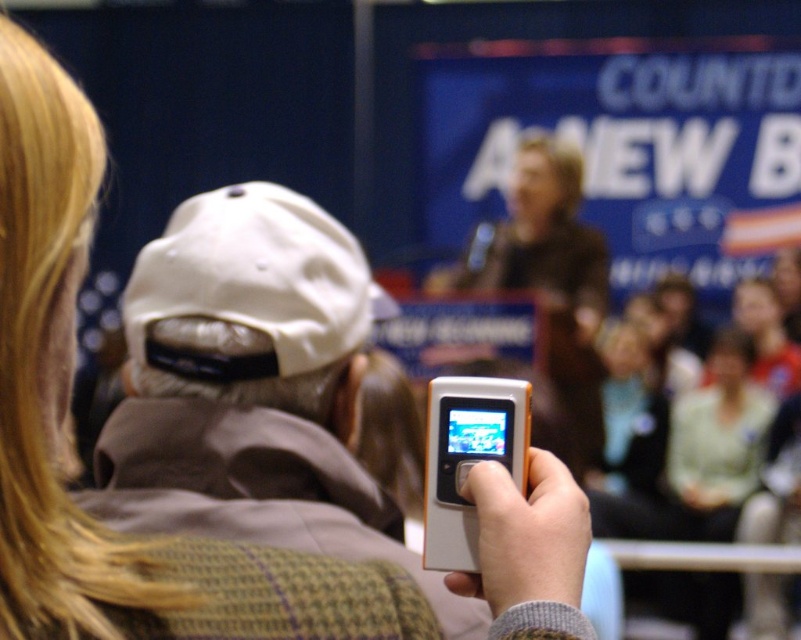
Consider the image. You are standing in the crowd at the event and want to take a photo of the stage. The white fabric cap at upper left is blocking your view. How far to the right should you move to avoid it?

The white fabric cap at upper left is located at point 0.559 on the horizontal axis. To avoid it, move to the right until your position is beyond 0.559 on the horizontal axis.

You are a photographer trying to capture the matte white cap at upper center and the white matte phone at center in a single frame. Based on their positions, which object should you adjust your camera to focus on first to ensure both are in the frame?

Since the matte white cap at upper center is to the left of the white matte phone at center, you should focus on the white matte phone at center first to ensure both objects are within the frame.

You are attending an event and see a person wearing a matte white cap at upper center holding a white matte phone at center. Which object takes up more space in the image?

The matte white cap at upper center has a larger size compared to the white matte phone at center, so it takes up more space in the image.